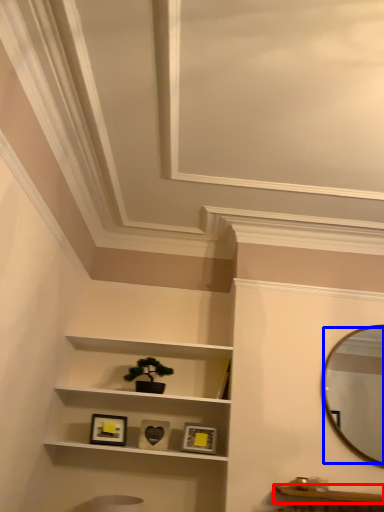
Question: Which object is closer to the camera taking this photo, cabinetry (highlighted by a red box) or mirror (highlighted by a blue box)?

Choices:
 (A) cabinetry
 (B) mirror

Answer: (A)